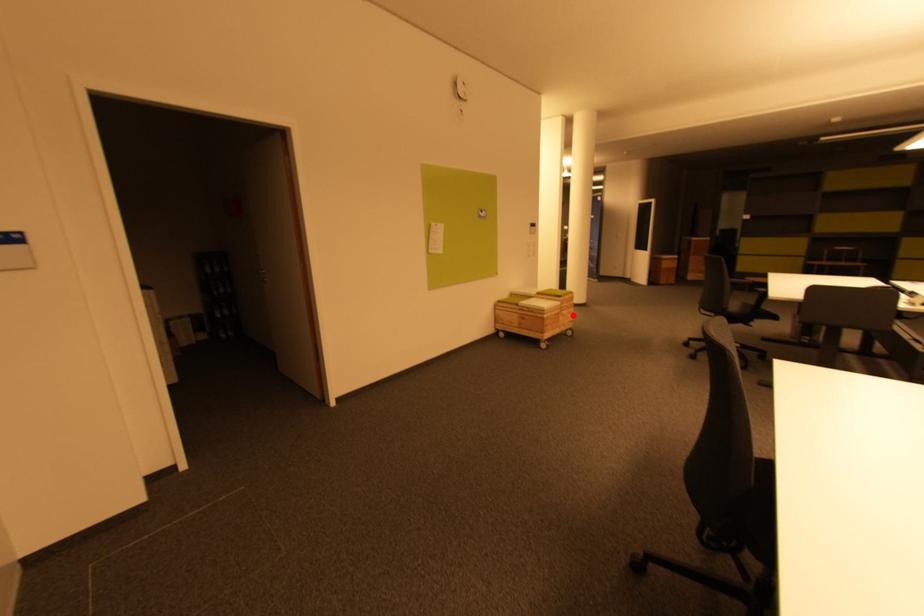
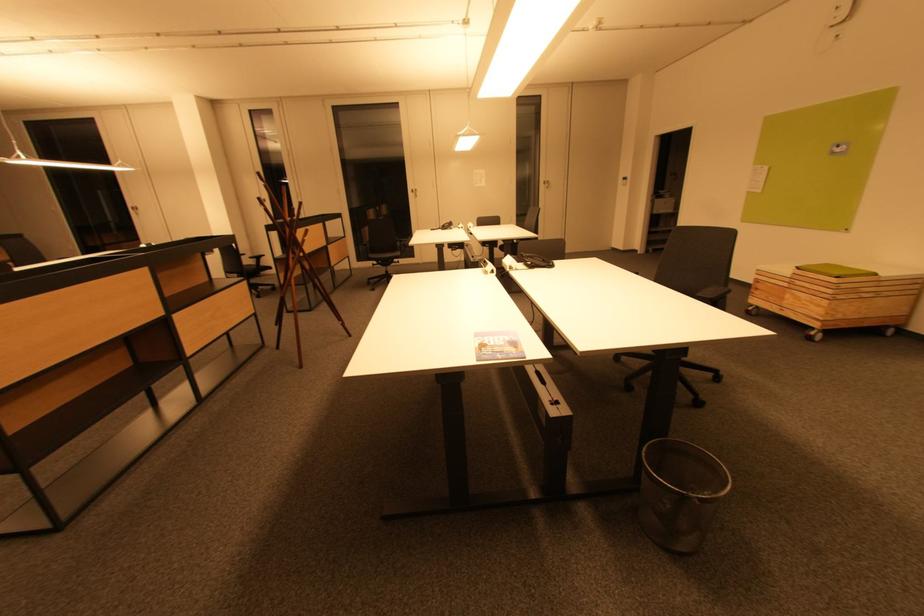
Question: A red point is marked in image1. In image2, is the corresponding 3D point closer to the camera or farther? Reply with the corresponding letter.

Choices:
 (A) The corresponding 3D point is closer.
 (B) The corresponding 3D point is farther.

Answer: (A)